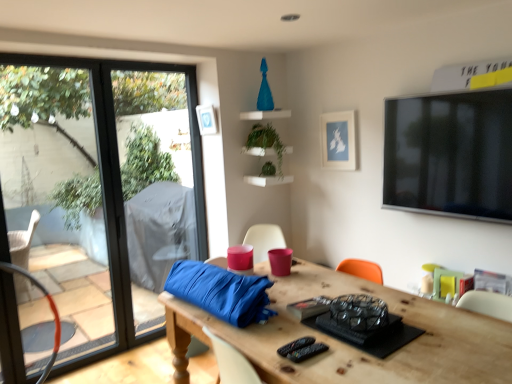
Locate an element on the screen. The image size is (512, 384). free spot above wooden table at center (from a real-world perspective) is located at coordinates (344, 333).